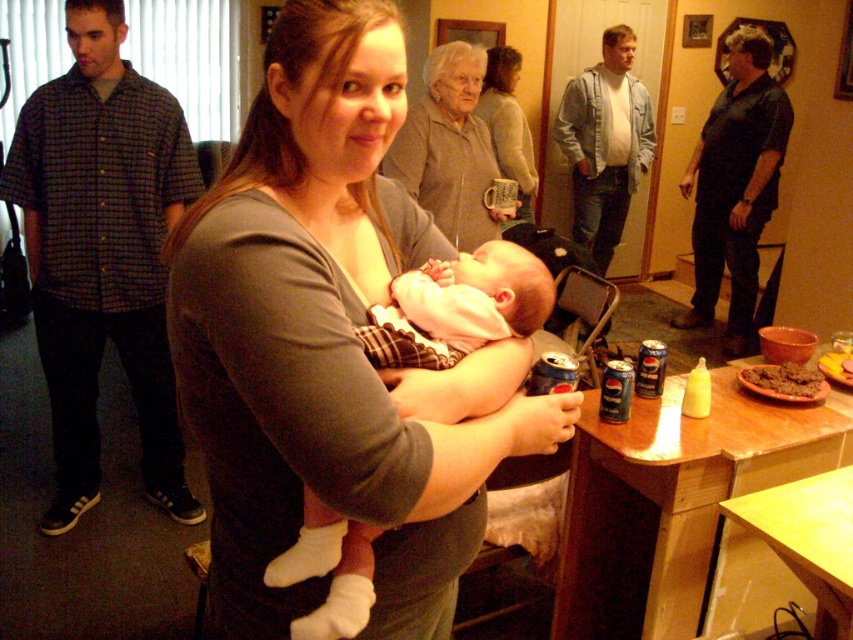
Question: Does wooden table at lower right appear under knitted sweater at upper center?

Choices:
 (A) no
 (B) yes

Answer: (B)

Question: Which of the following is the farthest from the observer?

Choices:
 (A) white soft fabric baby at center
 (B) matte gray shirt at center
 (C) knitted sweater at upper center

Answer: (C)

Question: Is matte gray shirt at center to the right of white soft fabric baby at center from the viewer's perspective?

Choices:
 (A) no
 (B) yes

Answer: (A)

Question: Does white soft fabric baby at center lie in front of matte gray sweater at center?

Choices:
 (A) yes
 (B) no

Answer: (A)

Question: Which point is closer to the camera?

Choices:
 (A) (440, 326)
 (B) (479, 451)
 (C) (805, 561)

Answer: (B)

Question: Which of these objects is positioned farthest from the white soft fabric baby at center?

Choices:
 (A) wooden table at lower right
 (B) matte gray shirt at center
 (C) knitted sweater at upper center
 (D) matte gray sweater at center

Answer: (C)